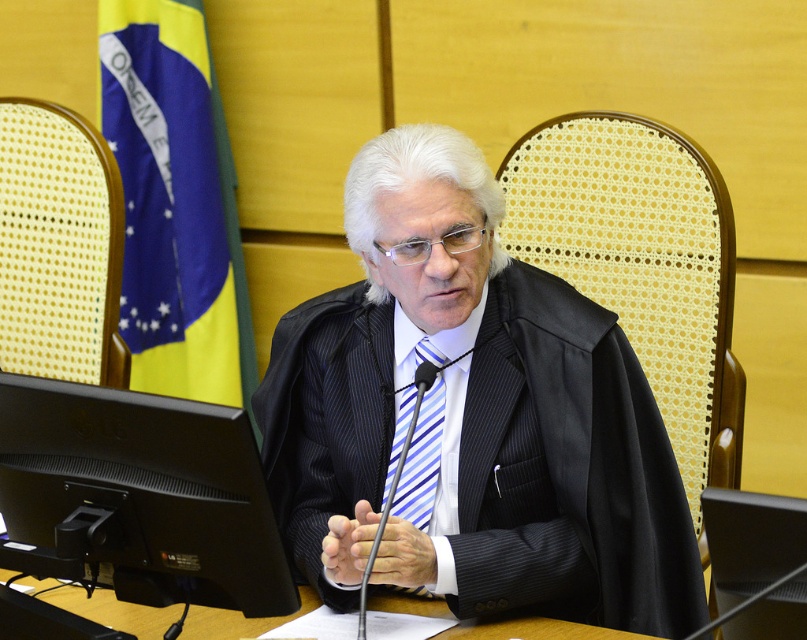
You are an interior designer planning to place a new sofa in the courtroom. The sofa must be positioned between the black pinstripe suit at center and the blue fabric flag at upper left. Given their sizes, which object should the sofa be closer to?

The black pinstripe suit at center has a larger size compared to the blue fabric flag at upper left, so the sofa should be closer to the blue fabric flag at upper left to accommodate the larger size of the black pinstripe suit at center.

You are an assistant in the courtroom. You need to place a document on the surface that can accommodate a large A3 sheet. Which object between the black glossy monitor at lower left and the wooden table at center would be suitable?

The wooden table at center is suitable for placing the large A3 sheet because the black glossy monitor at lower left is smaller in size than the wooden table at center.

In the scene shown: In the courtroom scene, there is a man wearing a black pinstripe suit at center and a Brazilian flag partially draped over a chair to the left. Based on the coordinates provided, can you identify which object the point at position (470, 417) corresponds to?

The point at position (470, 417) corresponds to the black pinstripe suit at center.